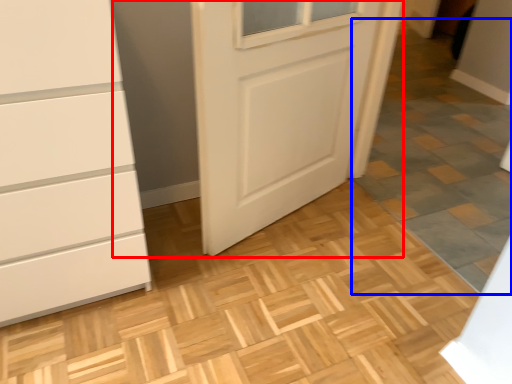
Question: Which object is closer to the camera taking this photo, door (highlighted by a red box) or tile (highlighted by a blue box)?

Choices:
 (A) door
 (B) tile

Answer: (B)